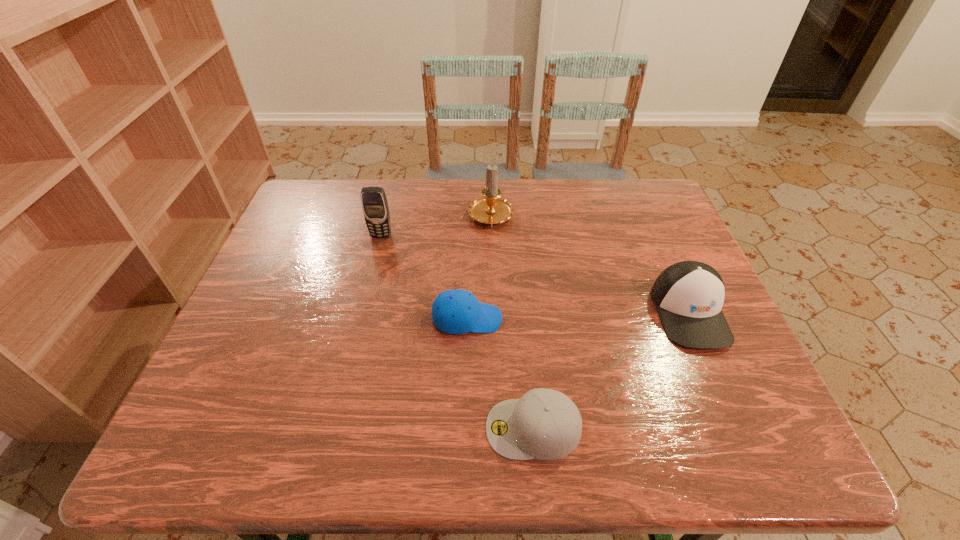
Locate an element on the screen. The image size is (960, 540). blank space located on the front-facing side of the nearest object is located at coordinates (324, 428).

Where is `object located in the far edge section of the desktop`? This screenshot has height=540, width=960. object located in the far edge section of the desktop is located at coordinates (491, 209).

This screenshot has height=540, width=960. Identify the location of object that is at the near edge. (545, 424).

This screenshot has width=960, height=540. Identify the location of object present at the right edge. (688, 295).

I want to click on free space at the far edge of the desktop, so point(585,184).

This screenshot has height=540, width=960. Identify the location of free location at the near edge. (500, 457).

In the image, there is a desktop. Where is `vacant area at the right edge`? vacant area at the right edge is located at coordinates (693, 382).

Locate an element on the screen. This screenshot has width=960, height=540. free region at the far left corner is located at coordinates (318, 197).

The height and width of the screenshot is (540, 960). In the image, there is a desktop. Identify the location of free space at the far right corner. (672, 224).

Locate an element on the screen. This screenshot has height=540, width=960. vacant space that is in between the rightmost object and the candle is located at coordinates (590, 266).